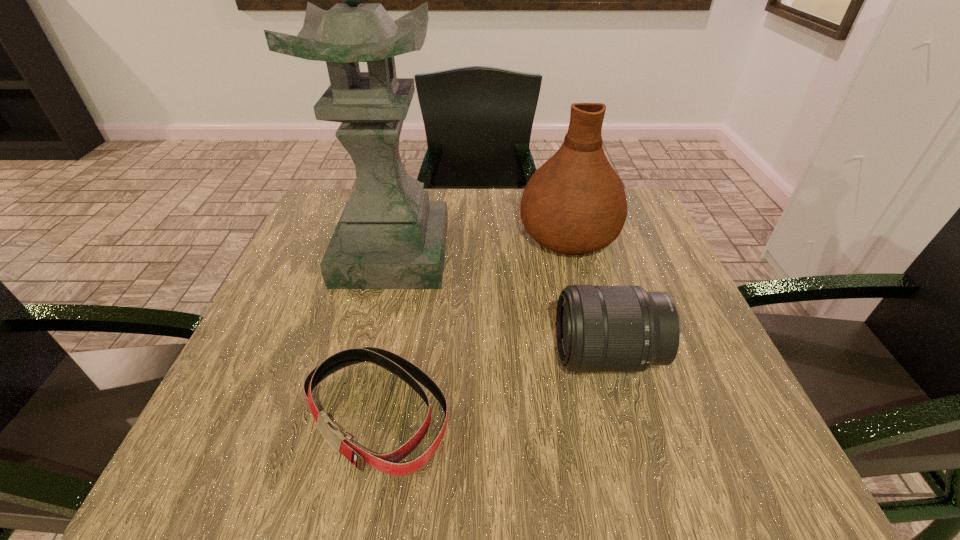
You are a GUI agent. You are given a task and a screenshot of the screen. Output one action in this format:
    pyautogui.click(x=<x>, y=<y>)
    Task: Click on the vacant area situated on the right of the shortest object
    
    Given the screenshot: What is the action you would take?
    pyautogui.click(x=696, y=414)

Where is `sculpture that is at the far edge`? The height and width of the screenshot is (540, 960). sculpture that is at the far edge is located at coordinates (390, 236).

The image size is (960, 540). Find the location of `pitcher present at the far edge`. pitcher present at the far edge is located at coordinates (575, 203).

Find the location of `object present at the near edge`. object present at the near edge is located at coordinates (387, 463).

Locate an element on the screen. Image resolution: width=960 pixels, height=540 pixels. sculpture located in the left edge section of the desktop is located at coordinates (390, 236).

You are a GUI agent. You are given a task and a screenshot of the screen. Output one action in this format:
    pyautogui.click(x=<x>, y=<y>)
    Task: Click on the dog collar that is at the left edge
    This screenshot has height=540, width=960.
    Given the screenshot: What is the action you would take?
    pyautogui.click(x=387, y=463)

In order to click on pitcher present at the right edge in this screenshot , I will do `click(575, 203)`.

Image resolution: width=960 pixels, height=540 pixels. I want to click on telephoto lens that is at the right edge, so click(x=598, y=328).

The width and height of the screenshot is (960, 540). I want to click on object located in the far left corner section of the desktop, so click(390, 236).

Locate an element on the screen. The height and width of the screenshot is (540, 960). object that is at the near left corner is located at coordinates (387, 463).